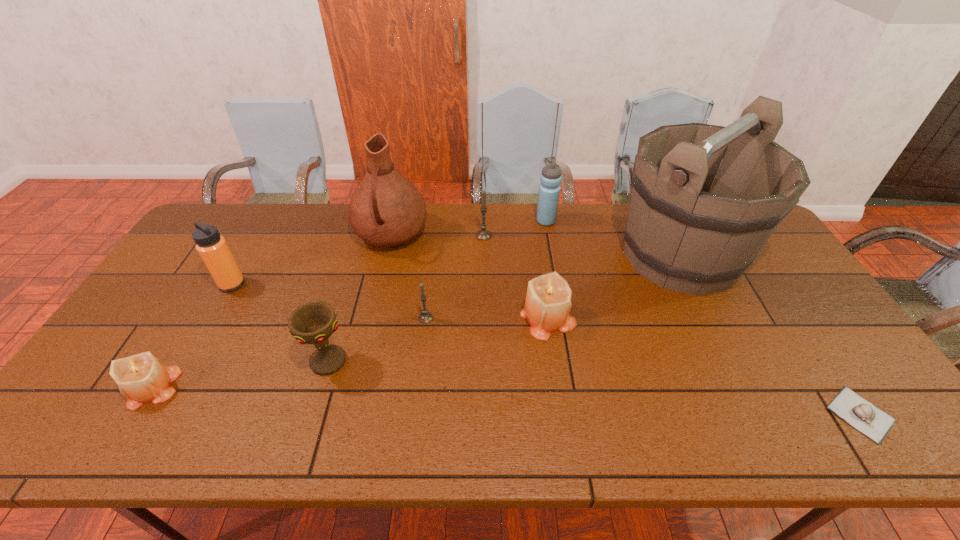
Point out which candle is positioned as the third nearest to the third candle from right to left. Please provide its 2D coordinates. Your answer should be formatted as a tuple, i.e. [(x, y)], where the tuple contains the x and y coordinates of a point satisfying the conditions above.

[(142, 378)]

Locate an element on the screen. vacant space that satisfies the following two spatial constraints: 1. on the side of the pitcher with the handle; 2. on the left side of the bucket is located at coordinates (387, 255).

Where is `free spot that satisfies the following two spatial constraints: 1. on the side of the second tallest object with the handle; 2. on the left side of the sixth object from right to left`? The height and width of the screenshot is (540, 960). free spot that satisfies the following two spatial constraints: 1. on the side of the second tallest object with the handle; 2. on the left side of the sixth object from right to left is located at coordinates (372, 318).

This screenshot has height=540, width=960. I want to click on blank space that satisfies the following two spatial constraints: 1. on the front side of the bucket; 2. on the right side of the right gray candle, so click(484, 255).

Where is `free point that satisfies the following two spatial constraints: 1. on the side of the tallest object with the handle; 2. on the right side of the pitcher`? free point that satisfies the following two spatial constraints: 1. on the side of the tallest object with the handle; 2. on the right side of the pitcher is located at coordinates (387, 255).